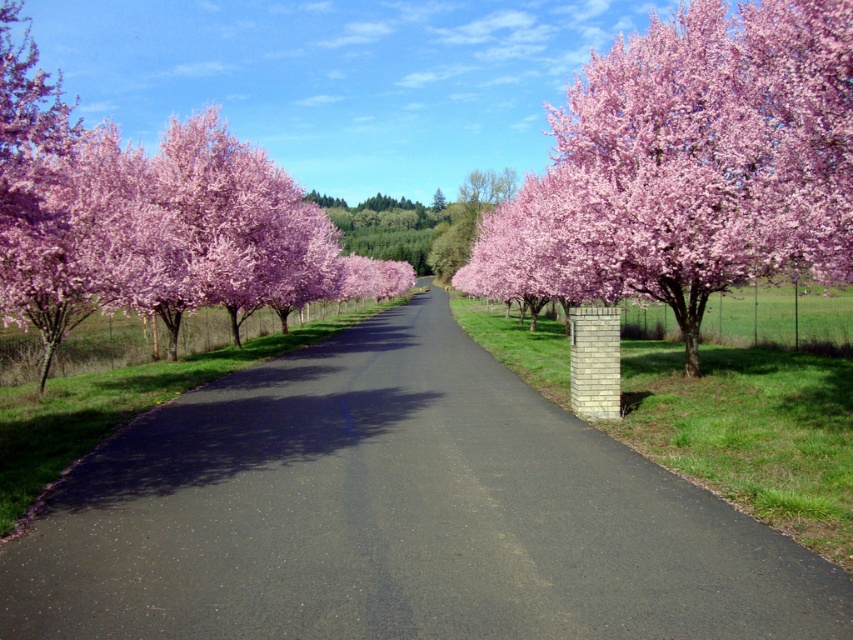
Can you confirm if pink bloom at center is positioned to the right of pink blossoming tree at left?

Yes, pink bloom at center is to the right of pink blossoming tree at left.

Can you confirm if pink bloom at center is positioned above pink blossoming tree at left?

Actually, pink bloom at center is below pink blossoming tree at left.

Find the location of a particular element. The image size is (853, 640). pink bloom at center is located at coordinates (688, 164).

This screenshot has height=640, width=853. Describe the element at coordinates (396, 515) in the screenshot. I see `black asphalt driveway at center` at that location.

Which is more to the right, black asphalt driveway at center or pink bloom at center?

Positioned to the right is pink bloom at center.

I want to click on black asphalt driveway at center, so tap(396, 515).

Is black asphalt driveway at center wider than pink blossoming tree at left?

In fact, black asphalt driveway at center might be narrower than pink blossoming tree at left.

Does point (392, 420) come behind point (9, 260)?

No.

Where is `black asphalt driveway at center`? This screenshot has height=640, width=853. black asphalt driveway at center is located at coordinates (396, 515).